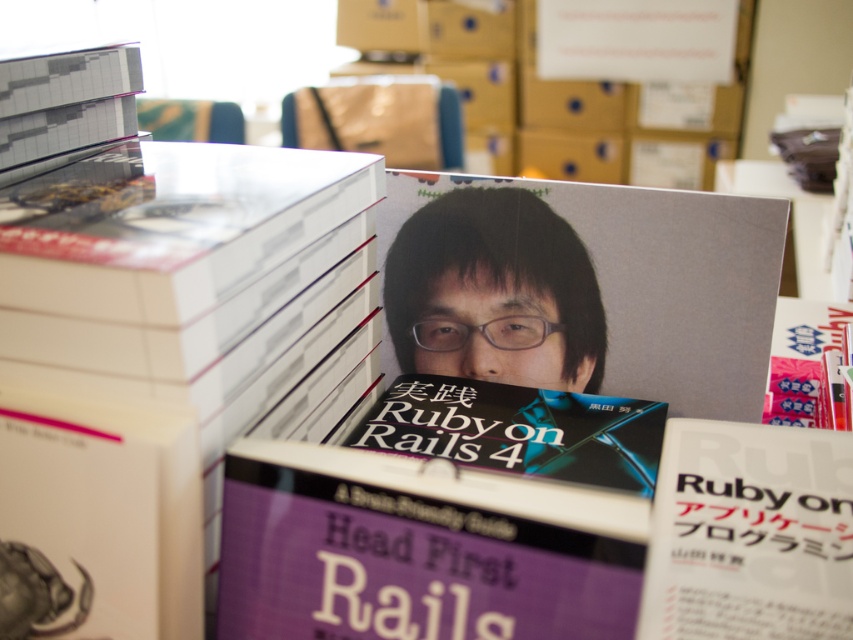
You are organizing a library shelf and need to place the matte black book at center and the black matte book at center. According to the image, which one should be placed on top to maintain the existing arrangement?

The matte black book at center should be placed on top of the black matte book at center because in the image, the matte black book at center is above the black matte book at center.

Consider the image. You are organizing a bookshelf and need to place the white paper book at center and the gray matte book at upper right. Since the shelf has limited space, which book should you place first to ensure both fit properly?

The white paper book at center is thinner than the gray matte book at upper right, so you should place the gray matte book at upper right first to accommodate its larger size before placing the thinner book.

You need to choose between the black matte book at center and the gray matte book at upper right for a quick reference guide. Which one is easier to carry around?

The black matte book at center is thinner than the gray matte book at upper right, so it is easier to carry around.